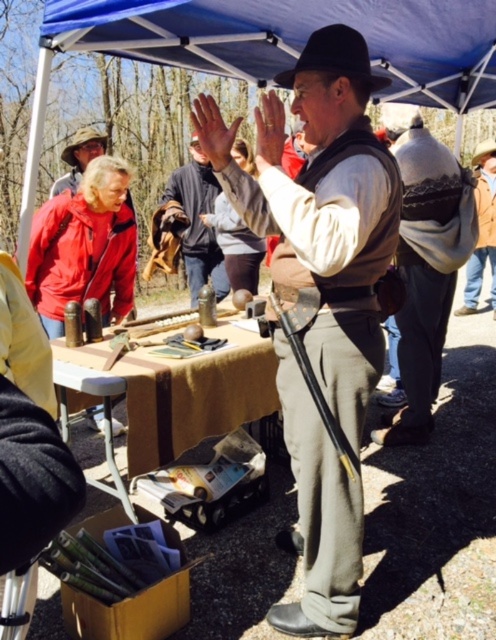
Question: Which point is closer to the camera?

Choices:
 (A) smooth skin hand at center
 (B) matte skin hand at center
 (C) leather gloves at center

Answer: (A)

Question: From the image, what is the correct spatial relationship of leather gloves at center in relation to matte skin hand at center?

Choices:
 (A) above
 (B) below

Answer: (A)

Question: Does blue fabric canopy at upper center appear over leather gloves at center?

Choices:
 (A) yes
 (B) no

Answer: (A)

Question: Is knitted wool sweater at center behind yellow fabric table at center?

Choices:
 (A) yes
 (B) no

Answer: (A)

Question: Among these objects, which one is nearest to the camera?

Choices:
 (A) matte brown vest at center
 (B) knitted wool sweater at center

Answer: (A)

Question: Based on their relative distances, which object is farther from the smooth skin hand at center?

Choices:
 (A) blue fabric canopy at upper center
 (B) matte skin hand at center

Answer: (A)